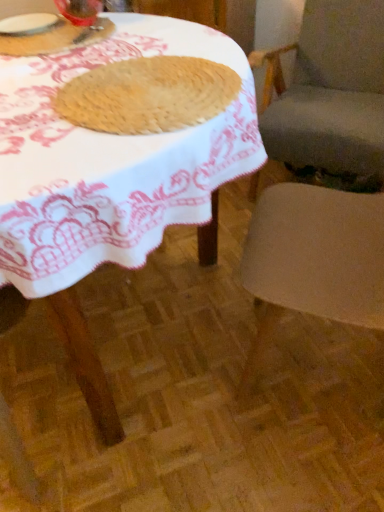
You are a GUI agent. You are given a task and a screenshot of the screen. Output one action in this format:
    pyautogui.click(x=<x>, y=<y>)
    Task: Click on the free space that is in between golden brown textured cookie at center and matte glass jar at upper left
    The width and height of the screenshot is (384, 512).
    Given the screenshot: What is the action you would take?
    pyautogui.click(x=103, y=57)